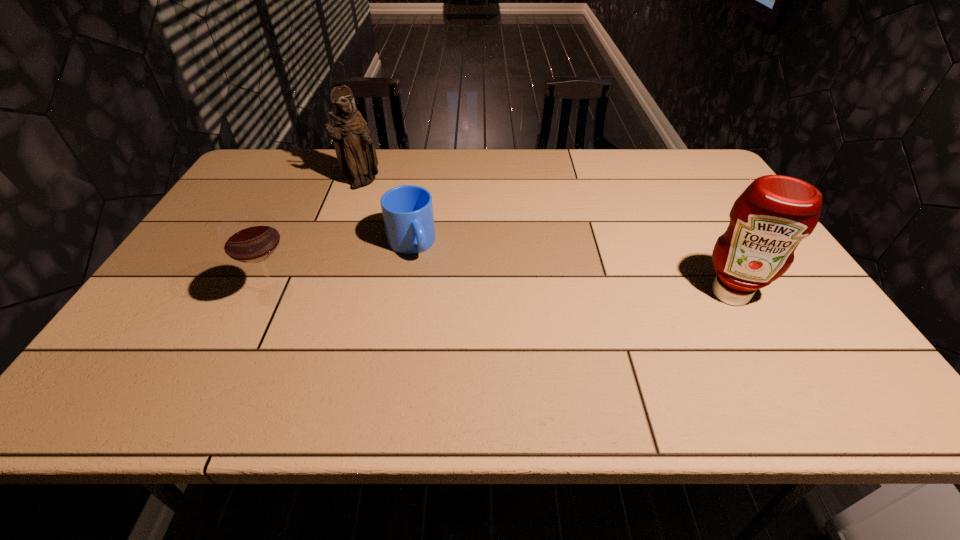
I want to click on vacant spot on the desktop that is between the second shortest object and the condiment and is positioned on the side of the mug with the handle, so click(439, 294).

Image resolution: width=960 pixels, height=540 pixels. I want to click on free spot on the desktop that is between the third tallest object and the rightmost object and is positioned on the front-facing side of the figurine, so [535, 294].